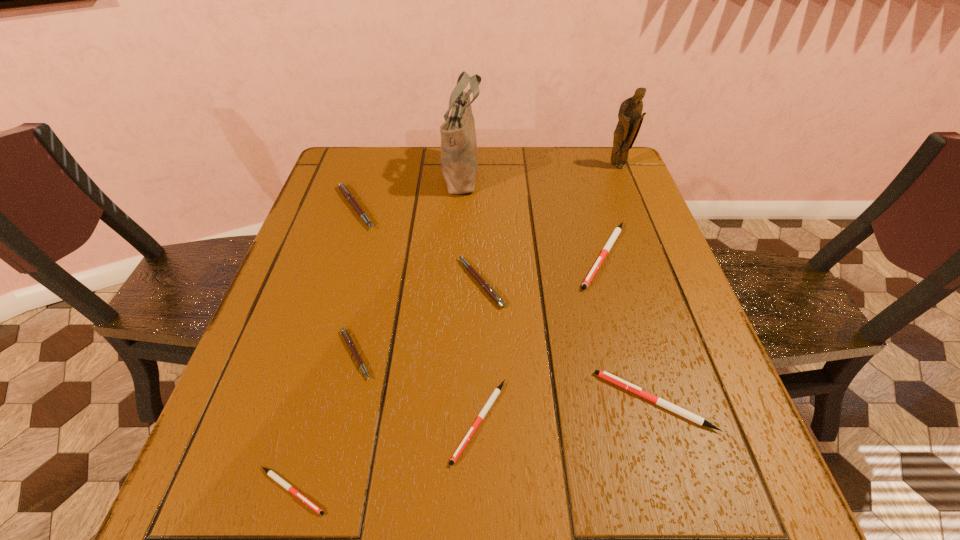
Locate an element on the screen. object located in the far left corner section of the desktop is located at coordinates (350, 198).

Identify the location of object present at the near left corner. This screenshot has width=960, height=540. (287, 486).

Where is `object present at the far right corner`? This screenshot has width=960, height=540. object present at the far right corner is located at coordinates (630, 116).

You are a GUI agent. You are given a task and a screenshot of the screen. Output one action in this format:
    pyautogui.click(x=<x>, y=<y>)
    Task: Click on the free space at the far edge
    This screenshot has height=540, width=960.
    Given the screenshot: What is the action you would take?
    pyautogui.click(x=385, y=181)

In the image, there is a desktop. Where is `vacant space at the near edge`? This screenshot has height=540, width=960. vacant space at the near edge is located at coordinates (444, 478).

Identify the location of vacant space at the left edge of the desktop. (366, 227).

You are a GUI agent. You are given a task and a screenshot of the screen. Output one action in this format:
    pyautogui.click(x=<x>, y=<y>)
    Task: Click on the vacant region at the right edge of the desktop
    
    Given the screenshot: What is the action you would take?
    pyautogui.click(x=614, y=198)

The height and width of the screenshot is (540, 960). I want to click on vacant space at the near right corner, so click(752, 503).

Locate an element on the screen. free space that is in between the farthest white pen and the tan shoulder bag is located at coordinates (533, 213).

Locate an element on the screen. This screenshot has width=960, height=540. vacant region between the leftmost white pen and the figurine is located at coordinates (455, 329).